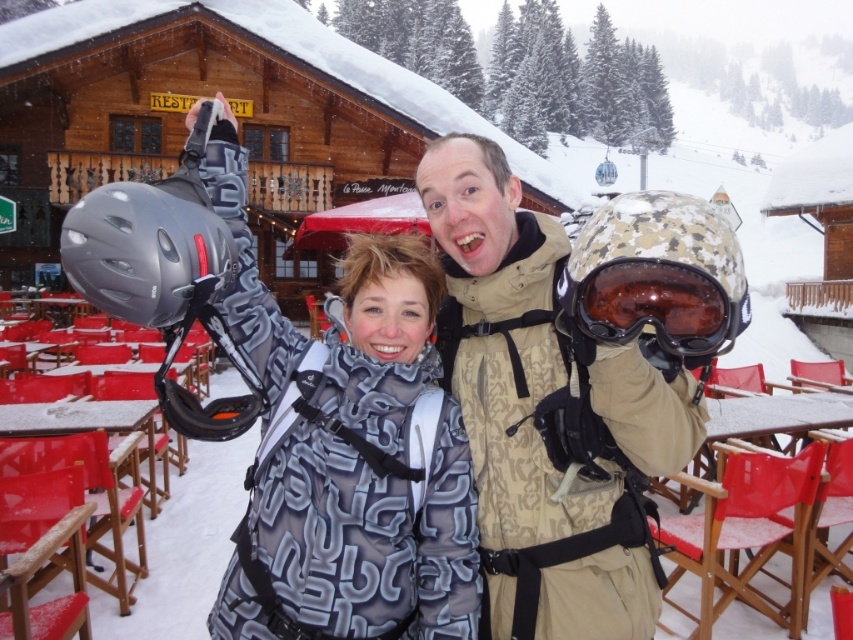
You are a photographer trying to capture a closeup shot of both the camouflage fabric helmet at center and the matte black goggles at center. Given that your camera can only focus on objects within a 50 cm range, will you be able to frame both items in the same shot without moving the camera?

The camouflage fabric helmet at center and the matte black goggles at center are 54.65 centimeters apart. Since the distance between them exceeds the camera focus range of 50 cm, you won

You are a photographer trying to capture a clear shot of both the camouflage fabric helmet at center and the matte black goggles at center. Since you want to ensure both are visible in your photo, which object should you focus on first to account for their size difference?

The camouflage fabric helmet at center is much taller than the matte black goggles at center, so you should focus on the camouflage fabric helmet at center first to ensure its full height is captured before adjusting for the smaller matte black goggles at center.

You are a photographer trying to capture both the matte black helmet at upper center and the camouflage fabric helmet at center in a single shot. Based on their positions, which helmet should you adjust your camera to focus on first to ensure both are in frame?

The matte black helmet at upper center is to the left of the camouflage fabric helmet at center, so you should focus on the camouflage fabric helmet at center first to ensure both are captured in the frame.